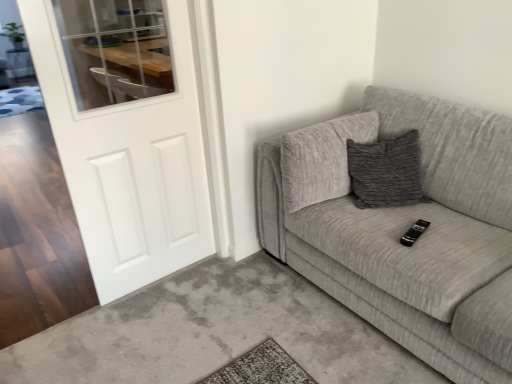
Question: Is textured gray couch at right far from black plastic remote at center?

Choices:
 (A) no
 (B) yes

Answer: (A)

Question: Considering the relative sizes of textured gray couch at right and black plastic remote at center in the image provided, is textured gray couch at right taller than black plastic remote at center?

Choices:
 (A) yes
 (B) no

Answer: (A)

Question: Considering the relative sizes of textured gray couch at right and black plastic remote at center in the image provided, is textured gray couch at right shorter than black plastic remote at center?

Choices:
 (A) no
 (B) yes

Answer: (A)

Question: Considering the relative sizes of textured gray couch at right and black plastic remote at center in the image provided, is textured gray couch at right bigger than black plastic remote at center?

Choices:
 (A) yes
 (B) no

Answer: (A)

Question: Is textured gray couch at right closer to camera compared to black plastic remote at center?

Choices:
 (A) yes
 (B) no

Answer: (A)

Question: Is point (413, 231) closer or farther from the camera than point (497, 331)?

Choices:
 (A) farther
 (B) closer

Answer: (A)

Question: From a real-world perspective, is black plastic remote at center physically located above or below textured gray couch at right?

Choices:
 (A) below
 (B) above

Answer: (B)

Question: Do you think black plastic remote at center is within textured gray couch at right, or outside of it?

Choices:
 (A) outside
 (B) inside

Answer: (B)

Question: Is black plastic remote at center taller or shorter than textured gray couch at right?

Choices:
 (A) tall
 (B) short

Answer: (B)

Question: Considering the positions of textured gray couch at right and white matte door at left in the image, is textured gray couch at right taller or shorter than white matte door at left?

Choices:
 (A) tall
 (B) short

Answer: (B)

Question: In terms of width, does textured gray couch at right look wider or thinner when compared to white matte door at left?

Choices:
 (A) wide
 (B) thin

Answer: (A)

Question: From the image's perspective, is textured gray couch at right located above or below white matte door at left?

Choices:
 (A) above
 (B) below

Answer: (B)

Question: Considering their positions, is textured gray couch at right located in front of or behind white matte door at left?

Choices:
 (A) behind
 (B) front

Answer: (B)

Question: From the image's perspective, relative to black plastic remote at center, is textured gray couch at right above or below?

Choices:
 (A) above
 (B) below

Answer: (A)

Question: In terms of height, does textured gray couch at right look taller or shorter compared to black plastic remote at center?

Choices:
 (A) tall
 (B) short

Answer: (A)